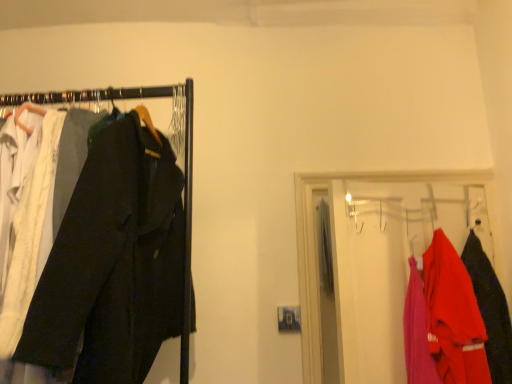
Find the location of a particular element. dark gray cotton trousers at left is located at coordinates (113, 262).

Is matte red jacket at right next to dark gray cotton trousers at left?

No, matte red jacket at right is not in contact with dark gray cotton trousers at left.

Would you say matte red jacket at right is to the left or to the right of dark gray cotton trousers at left in the picture?

In the image, matte red jacket at right appears on the right side of dark gray cotton trousers at left.

Looking at this image, is matte red jacket at right facing towards dark gray cotton trousers at left?

No, matte red jacket at right is not facing towards dark gray cotton trousers at left.

Considering the sizes of matte red jacket at right, placed as the 2th clothing when sorted from right to left, and matte red jacket at right in the image, is matte red jacket at right, placed as the 2th clothing when sorted from right to left, wider or thinner than matte red jacket at right?

Clearly, matte red jacket at right, placed as the 2th clothing when sorted from right to left, has more width compared to matte red jacket at right.

Considering the relative sizes of matte red jacket at right, the 1th clothing from the left, and matte red jacket at right in the image provided, is matte red jacket at right, the 1th clothing from the left, shorter than matte red jacket at right?

Indeed, matte red jacket at right, the 1th clothing from the left, has a lesser height compared to matte red jacket at right.

From the image's perspective, which one is positioned higher, matte red jacket at right, placed as the 2th clothing when sorted from right to left, or matte red jacket at right?

matte red jacket at right, from the image's perspective.

In the scene shown: How different are the orientations of matte red jacket at right, placed as the 2th clothing when sorted from right to left, and matte red jacket at right in degrees?

There is a 91.8-degree angle between the facing directions of matte red jacket at right, placed as the 2th clothing when sorted from right to left, and matte red jacket at right.

Is matte red jacket at right, the 1th clothing from the left, facing away from dark gray cotton trousers at left?

No, matte red jacket at right, the 1th clothing from the left, is not facing the opposite direction of dark gray cotton trousers at left.

Looking at their sizes, would you say matte red jacket at right, the 1th clothing from the left, is wider or thinner than dark gray cotton trousers at left?

Clearly, matte red jacket at right, the 1th clothing from the left, has less width compared to dark gray cotton trousers at left.

Can you tell me how much matte red jacket at right, placed as the 2th clothing when sorted from right to left, and dark gray cotton trousers at left differ in facing direction?

The facing directions of matte red jacket at right, placed as the 2th clothing when sorted from right to left, and dark gray cotton trousers at left are 67.2 degrees apart.

Is point (450, 334) positioned after point (80, 312)?

That is True.

Is matte red jacket at right, which appears as the 2th clothing when viewed from the left, beside matte red jacket at right?

No, matte red jacket at right, which appears as the 2th clothing when viewed from the left, is not beside matte red jacket at right.

Choose the correct answer: Is matte red jacket at right, the 1th clothing when ordered from right to left, inside matte red jacket at right or outside it?

matte red jacket at right, the 1th clothing when ordered from right to left, can be found inside matte red jacket at right.

Considering the sizes of objects matte red jacket at right, the 1th clothing when ordered from right to left, and matte red jacket at right in the image provided, who is smaller, matte red jacket at right, the 1th clothing when ordered from right to left, or matte red jacket at right?

matte red jacket at right, the 1th clothing when ordered from right to left, is smaller.

Is the depth of matte red jacket at right, which appears as the 2th clothing when viewed from the left, less than that of matte red jacket at right?

No, the depth of matte red jacket at right, which appears as the 2th clothing when viewed from the left, is greater than that of matte red jacket at right.

Is matte red jacket at right, the 1th clothing when ordered from right to left, surrounding matte red jacket at right, placed as the 2th clothing when sorted from right to left?

No.

Considering the sizes of matte red jacket at right, which appears as the 2th clothing when viewed from the left, and matte red jacket at right, the 1th clothing from the left, in the image, is matte red jacket at right, which appears as the 2th clothing when viewed from the left, taller or shorter than matte red jacket at right, the 1th clothing from the left,?

In the image, matte red jacket at right, which appears as the 2th clothing when viewed from the left, appears to be taller than matte red jacket at right, the 1th clothing from the left.

Which is more to the right, matte red jacket at right, the 1th clothing when ordered from right to left, or matte red jacket at right, the 1th clothing from the left?

From the viewer's perspective, matte red jacket at right, the 1th clothing when ordered from right to left, appears more on the right side.

Which of these two, dark gray cotton trousers at left or matte red jacket at right, is thinner?

With smaller width is matte red jacket at right.

Can you confirm if dark gray cotton trousers at left is positioned to the left of matte red jacket at right?

Correct, you'll find dark gray cotton trousers at left to the left of matte red jacket at right.

Consider the image. Does dark gray cotton trousers at left have a lesser height compared to matte red jacket at right?

Incorrect, the height of dark gray cotton trousers at left does not fall short of that of matte red jacket at right.

Who is taller, matte red jacket at right, which appears as the 2th clothing when viewed from the left, or dark gray cotton trousers at left?

dark gray cotton trousers at left.

Is matte red jacket at right, which appears as the 2th clothing when viewed from the left, directly adjacent to dark gray cotton trousers at left?

No, matte red jacket at right, which appears as the 2th clothing when viewed from the left, is not touching dark gray cotton trousers at left.

Considering the relative positions of matte red jacket at right, the 1th clothing when ordered from right to left, and dark gray cotton trousers at left in the image provided, is matte red jacket at right, the 1th clothing when ordered from right to left, to the left of dark gray cotton trousers at left from the viewer's perspective?

Incorrect, matte red jacket at right, the 1th clothing when ordered from right to left, is not on the left side of dark gray cotton trousers at left.

You are a GUI agent. You are given a task and a screenshot of the screen. Output one action in this format:
    pyautogui.click(x=<x>, y=<y>)
    Task: Click on the trousers located above the matte red jacket at right (from a real-world perspective)
    This screenshot has height=384, width=512.
    Given the screenshot: What is the action you would take?
    pyautogui.click(x=113, y=262)

Identify the location of closet that appears behind the matte red jacket at right, the 1th clothing from the left. This screenshot has width=512, height=384. (398, 273).

Estimate the real-world distances between objects in this image. Which object is closer to matte red jacket at right, the 1th clothing when ordered from right to left, dark gray cotton trousers at left or matte red jacket at right, placed as the 2th clothing when sorted from right to left?

matte red jacket at right, placed as the 2th clothing when sorted from right to left.

Which object lies further to the anchor point matte red jacket at right, dark gray cotton trousers at left or matte red jacket at right, which appears as the 2th clothing when viewed from the left?

Based on the image, dark gray cotton trousers at left appears to be further to matte red jacket at right.

Based on their spatial positions, is matte red jacket at right, the 1th clothing from the left, or matte red jacket at right closer to dark gray cotton trousers at left?

matte red jacket at right is positioned closer to the anchor dark gray cotton trousers at left.

Based on their spatial positions, is matte red jacket at right, placed as the 2th clothing when sorted from right to left, or dark gray cotton trousers at left further from matte red jacket at right, which appears as the 2th clothing when viewed from the left?

dark gray cotton trousers at left lies further to matte red jacket at right, which appears as the 2th clothing when viewed from the left, than the other object.

Estimate the real-world distances between objects in this image. Which object is further from matte red jacket at right, the 1th clothing from the left, matte red jacket at right or matte red jacket at right, which appears as the 2th clothing when viewed from the left?

Among the two, matte red jacket at right, which appears as the 2th clothing when viewed from the left, is located further to matte red jacket at right, the 1th clothing from the left.

Which object lies further to the anchor point matte red jacket at right, placed as the 2th clothing when sorted from right to left, dark gray cotton trousers at left or matte red jacket at right, which appears as the 2th clothing when viewed from the left?

Among the two, dark gray cotton trousers at left is located further to matte red jacket at right, placed as the 2th clothing when sorted from right to left.

In the scene shown: When comparing their distances from dark gray cotton trousers at left, does matte red jacket at right, which appears as the 2th clothing when viewed from the left, or matte red jacket at right seem closer?

The object closer to dark gray cotton trousers at left is matte red jacket at right.

Estimate the real-world distances between objects in this image. Which object is further from dark gray cotton trousers at left, matte red jacket at right or matte red jacket at right, the 1th clothing from the left?

matte red jacket at right, the 1th clothing from the left, is further to dark gray cotton trousers at left.

At what (x,y) coordinates should I click in order to perform the action: click on closet between dark gray cotton trousers at left and matte red jacket at right, the 1th clothing when ordered from right to left, in the horizontal direction. Please return your answer as a coordinate pair (x, y). Looking at the image, I should click on (398, 273).

Where is `clothing between matte red jacket at right and matte red jacket at right, which appears as the 2th clothing when viewed from the left, in the horizontal direction`? Image resolution: width=512 pixels, height=384 pixels. clothing between matte red jacket at right and matte red jacket at right, which appears as the 2th clothing when viewed from the left, in the horizontal direction is located at coordinates (453, 316).

I want to click on closet located between dark gray cotton trousers at left and matte red jacket at right, placed as the 2th clothing when sorted from right to left, in the left-right direction, so click(398, 273).

I want to click on clothing located between dark gray cotton trousers at left and matte red jacket at right, which appears as the 2th clothing when viewed from the left, in the left-right direction, so click(x=453, y=316).